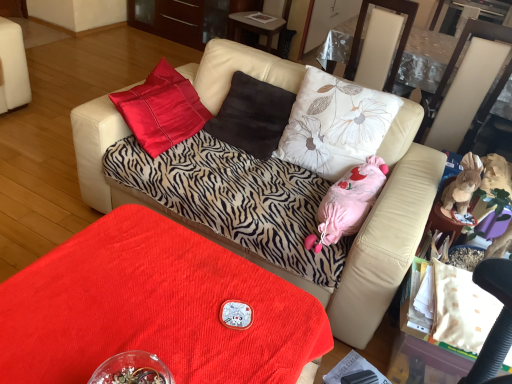
Question: From the image's perspective, does brown plush toy at right, which ranks as the second animal in left-to-right order, appear lower than brown suede pillow at center, positioned as the first pillow in left-to-right order?

Choices:
 (A) no
 (B) yes

Answer: (B)

Question: From a real-world perspective, does brown plush toy at right, which ranks as the second animal in left-to-right order, sit lower than brown suede pillow at center, positioned as the first pillow in left-to-right order?

Choices:
 (A) no
 (B) yes

Answer: (A)

Question: Is brown plush toy at right, which ranks as the second animal in left-to-right order, not inside brown suede pillow at center, positioned as the first pillow in left-to-right order?

Choices:
 (A) no
 (B) yes

Answer: (B)

Question: Does brown plush toy at right, which ranks as the second animal in left-to-right order, have a greater height compared to brown suede pillow at center, which appears as the second pillow when viewed from the right?

Choices:
 (A) no
 (B) yes

Answer: (A)

Question: Does brown plush toy at right, which ranks as the second animal in left-to-right order, have a lesser width compared to brown suede pillow at center, positioned as the first pillow in left-to-right order?

Choices:
 (A) no
 (B) yes

Answer: (B)

Question: Is brown plush toy at right, which ranks as the second animal in left-to-right order, further to the viewer compared to brown suede pillow at center, positioned as the first pillow in left-to-right order?

Choices:
 (A) yes
 (B) no

Answer: (B)

Question: Does floral fabric pillow at center, which is the 1th pillow in right-to-left order, have a lesser width compared to brown plush toy at right, which is the 1th animal in right-to-left order?

Choices:
 (A) no
 (B) yes

Answer: (A)

Question: Can you confirm if floral fabric pillow at center, positioned as the second pillow in left-to-right order, is smaller than brown plush toy at right, which is the 1th animal in right-to-left order?

Choices:
 (A) no
 (B) yes

Answer: (A)

Question: Is brown plush toy at right, which is the 1th animal in right-to-left order, located within floral fabric pillow at center, which is the 1th pillow in right-to-left order?

Choices:
 (A) no
 (B) yes

Answer: (A)

Question: From a real-world perspective, is floral fabric pillow at center, which is the 1th pillow in right-to-left order, beneath brown plush toy at right, which is the 1th animal in right-to-left order?

Choices:
 (A) no
 (B) yes

Answer: (A)

Question: Is floral fabric pillow at center, positioned as the second pillow in left-to-right order, placed right next to brown plush toy at right, which is the 1th animal in right-to-left order?

Choices:
 (A) yes
 (B) no

Answer: (B)

Question: Considering the relative positions of floral fabric pillow at center, which is the 1th pillow in right-to-left order, and brown plush toy at right, which ranks as the second animal in left-to-right order, in the image provided, is floral fabric pillow at center, which is the 1th pillow in right-to-left order, to the left of brown plush toy at right, which ranks as the second animal in left-to-right order, from the viewer's perspective?

Choices:
 (A) no
 (B) yes

Answer: (B)

Question: Considering the relative sizes of pink fabric stuffed toy at center, the first animal positioned from the left, and transparent plastic glass table at upper right in the image provided, is pink fabric stuffed toy at center, the first animal positioned from the left, bigger than transparent plastic glass table at upper right?

Choices:
 (A) no
 (B) yes

Answer: (A)